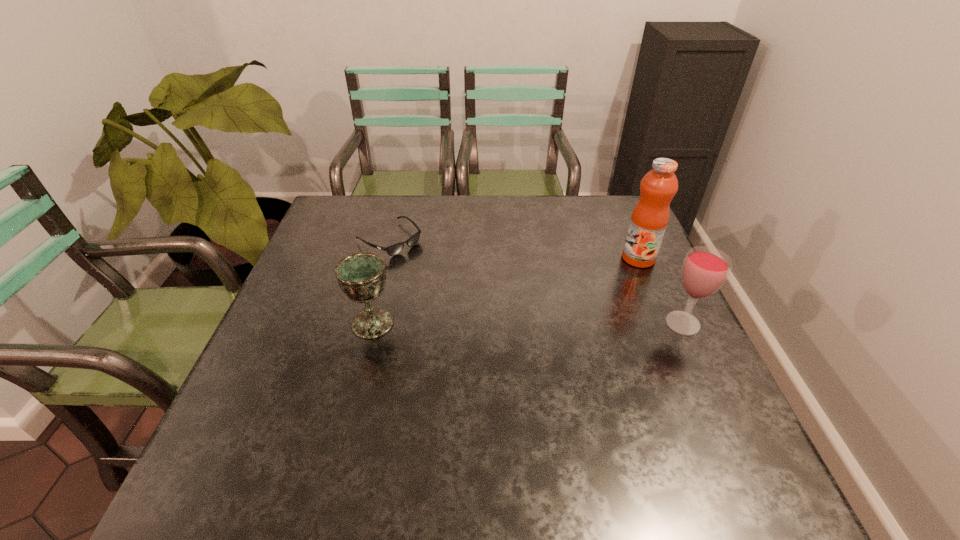
This screenshot has height=540, width=960. Find the location of `chalice`. chalice is located at coordinates (362, 276).

Image resolution: width=960 pixels, height=540 pixels. In order to click on wineglass in this screenshot , I will do `click(705, 269)`.

I want to click on the shortest object, so click(395, 249).

Find the location of `the tallest object`. the tallest object is located at coordinates (649, 219).

At what (x,y) coordinates should I click in order to perform the action: click on free space located on the back of the chalice. Please return your answer as a coordinate pair (x, y). This screenshot has height=540, width=960. Looking at the image, I should click on (394, 241).

This screenshot has width=960, height=540. I want to click on free space located 0.150m on the back of the wineglass, so click(x=658, y=271).

Where is `vacant space located on the front-facing side of the sunglasses`? vacant space located on the front-facing side of the sunglasses is located at coordinates tap(471, 299).

This screenshot has height=540, width=960. Find the location of `vacant space located on the front-facing side of the sunglasses`. vacant space located on the front-facing side of the sunglasses is located at coordinates (459, 289).

This screenshot has height=540, width=960. I want to click on free region located on the front-facing side of the sunglasses, so click(425, 265).

This screenshot has width=960, height=540. Identify the location of free space located on the front label of the tallest object. (526, 317).